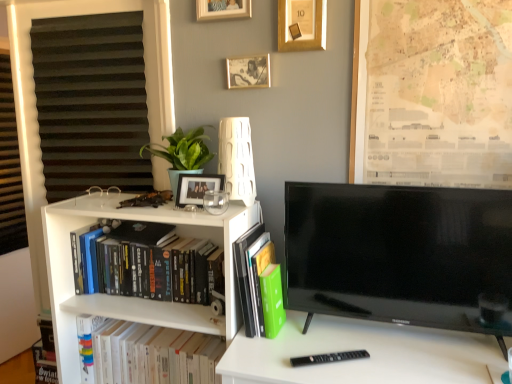
Locate an element on the screen. vacant area that lies between green matte book at center, the second book from the top, and black glossy tv at right is located at coordinates point(351,341).